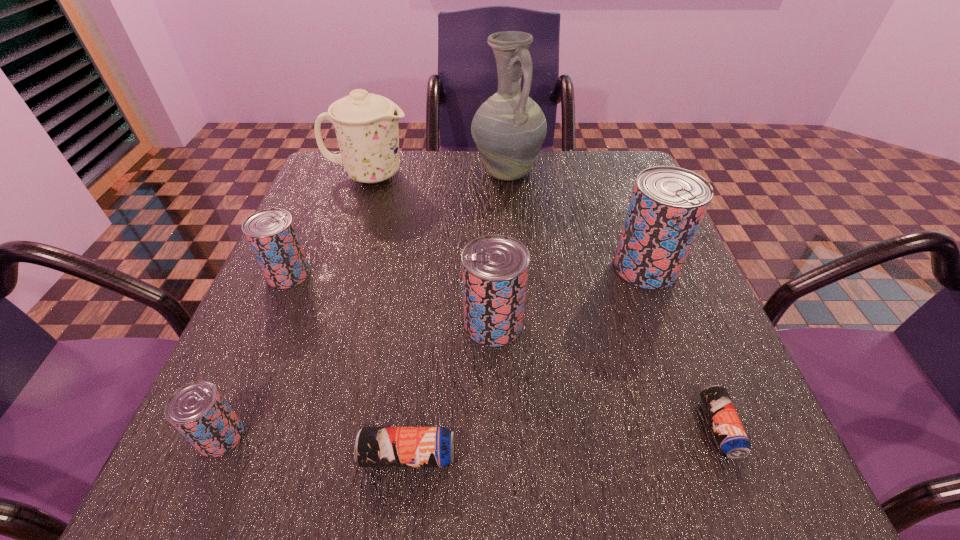
The image size is (960, 540). I want to click on vacant region at the left edge of the desktop, so click(321, 211).

Locate an element on the screen. This screenshot has height=540, width=960. vacant space at the right edge of the desktop is located at coordinates (721, 349).

Image resolution: width=960 pixels, height=540 pixels. In the image, there is a desktop. In order to click on vacant space at the far left corner in this screenshot , I will do `click(324, 181)`.

I want to click on free location at the near left corner of the desktop, so click(183, 492).

Find the location of a particular element. This screenshot has height=540, width=960. vacant space at the near right corner is located at coordinates (757, 438).

Where is `unoccupied area between the fifth tallest beer can and the third beer can from right to left`? unoccupied area between the fifth tallest beer can and the third beer can from right to left is located at coordinates (450, 389).

The width and height of the screenshot is (960, 540). I want to click on free spot between the pitcher and the fourth tallest beer can, so (x=364, y=305).

I want to click on vacant point located between the fourth nearest object and the right blue beer can, so click(607, 375).

What are the coordinates of `free area in between the second shortest object and the tallest beer can` in the screenshot? It's located at (526, 361).

The image size is (960, 540). Find the location of `free space between the nearest red beer can and the left blue beer can`. free space between the nearest red beer can and the left blue beer can is located at coordinates (314, 446).